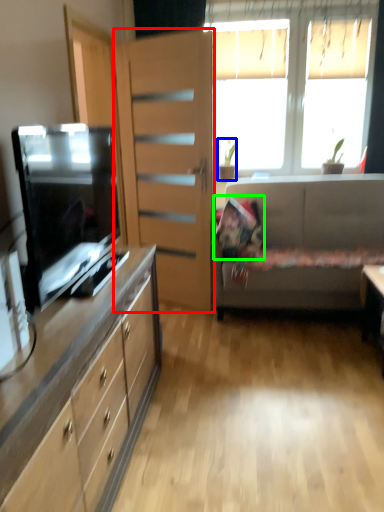
Question: Which is nearer to the file cabinet (highlighted by a red box)? houseplant (highlighted by a blue box) or pillow (highlighted by a green box).

Choices:
 (A) houseplant
 (B) pillow

Answer: (B)